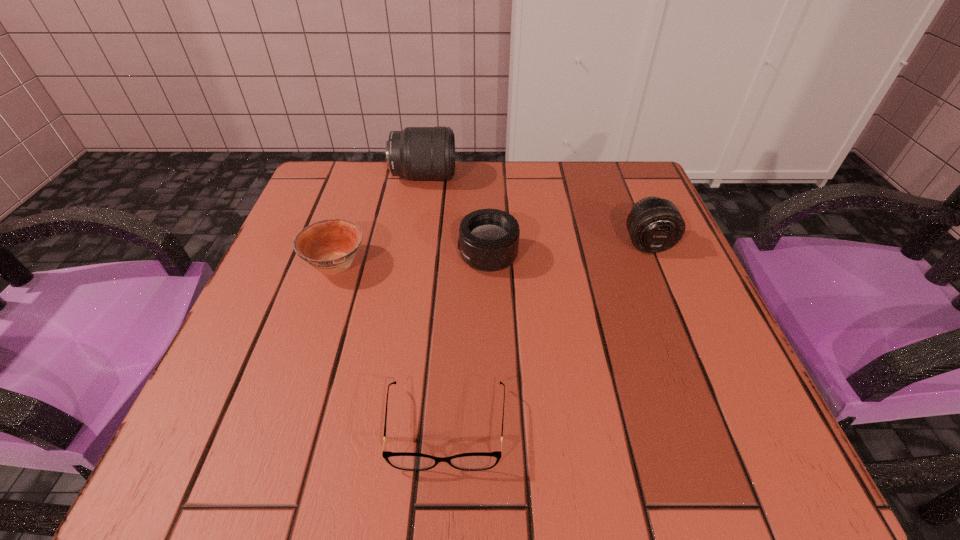
In the image, there is a desktop. Identify the location of vacant space at the left edge. (330, 279).

This screenshot has width=960, height=540. Find the location of `free region at the right edge of the desktop`. free region at the right edge of the desktop is located at coordinates (691, 300).

What are the coordinates of `vacant space at the far right corner of the desktop` in the screenshot? It's located at (622, 188).

I want to click on blank space at the near right corner of the desktop, so click(673, 455).

This screenshot has width=960, height=540. Identify the location of free space between the second shortest telephoto lens and the farthest telephoto lens. (536, 210).

The height and width of the screenshot is (540, 960). In order to click on free spot between the rightmost telephoto lens and the farthest telephoto lens in this screenshot , I will do `click(536, 210)`.

The height and width of the screenshot is (540, 960). What are the coordinates of `vacant area that lies between the second telephoto lens from left to right and the rightmost object` in the screenshot? It's located at (567, 249).

Locate an element on the screen. This screenshot has width=960, height=540. blank region between the leftmost telephoto lens and the nearest object is located at coordinates (x=435, y=302).

Locate an element on the screen. free space between the spectacles and the leftmost object is located at coordinates (391, 346).

The height and width of the screenshot is (540, 960). I want to click on free spot between the leftmost object and the second telephoto lens from left to right, so click(x=412, y=260).